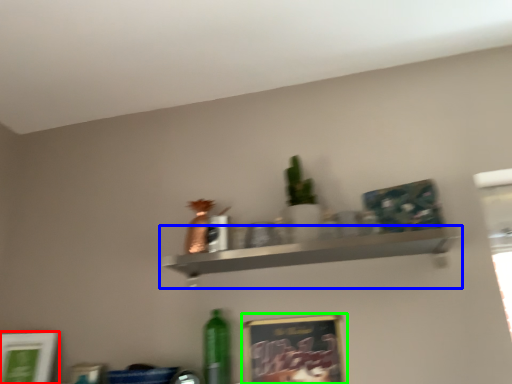
Question: Considering the real-world distances, which object is farthest from picture frame (highlighted by a red box)? shelf (highlighted by a blue box) or picture frame (highlighted by a green box)?

Choices:
 (A) shelf
 (B) picture frame

Answer: (A)